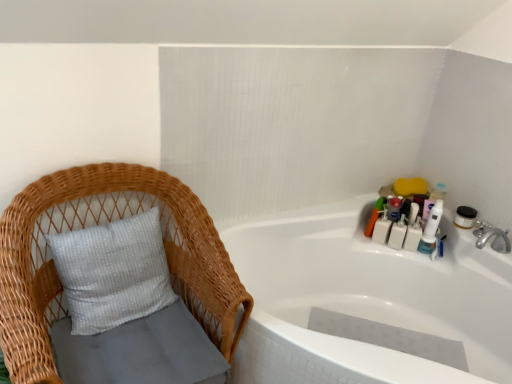
Question: From a real-world perspective, does white plastic bottles at upper right, the fourth toiletry in the right-to-left sequence, stand above white plastic toothbrush at upper right, which is counted as the first toiletry, starting from the right?

Choices:
 (A) yes
 (B) no

Answer: (B)

Question: Considering the relative sizes of white plastic bottles at upper right, the fourth toiletry in the right-to-left sequence, and white plastic toothbrush at upper right, which is counted as the first toiletry, starting from the right, in the image provided, is white plastic bottles at upper right, the fourth toiletry in the right-to-left sequence, taller than white plastic toothbrush at upper right, which is counted as the first toiletry, starting from the right,?

Choices:
 (A) yes
 (B) no

Answer: (B)

Question: Is the position of white plastic bottles at upper right, positioned as the 3th toiletry in left-to-right order, more distant than that of white plastic toothbrush at upper right, which is the 6th toiletry from left to right?

Choices:
 (A) no
 (B) yes

Answer: (B)

Question: Does white plastic bottles at upper right, positioned as the 3th toiletry in left-to-right order, appear on the right side of white plastic toothbrush at upper right, which is the 6th toiletry from left to right?

Choices:
 (A) yes
 (B) no

Answer: (B)

Question: From a real-world perspective, is white plastic bottles at upper right, the fourth toiletry in the right-to-left sequence, located beneath white plastic toothbrush at upper right, which is counted as the first toiletry, starting from the right?

Choices:
 (A) yes
 (B) no

Answer: (A)

Question: Does white plastic bottles at upper right, the fourth toiletry in the right-to-left sequence, appear on the left side of white plastic toothbrush at upper right, which is counted as the first toiletry, starting from the right?

Choices:
 (A) no
 (B) yes

Answer: (B)

Question: Is white plastic toothbrush at upper right, which is the 6th toiletry from left to right, looking in the opposite direction of white plastic bottles at upper right, the fifth toiletry when ordered from right to left?

Choices:
 (A) no
 (B) yes

Answer: (A)

Question: From a real-world perspective, does white plastic toothbrush at upper right, which is counted as the first toiletry, starting from the right, stand above white plastic bottles at upper right, the fifth toiletry when ordered from right to left?

Choices:
 (A) no
 (B) yes

Answer: (B)

Question: Is white plastic toothbrush at upper right, which is counted as the first toiletry, starting from the right, to the left of white plastic bottles at upper right, the fifth toiletry when ordered from right to left, from the viewer's perspective?

Choices:
 (A) yes
 (B) no

Answer: (B)

Question: Is white plastic toothbrush at upper right, which is the 6th toiletry from left to right, in contact with white plastic bottles at upper right, which is the second toiletry in left-to-right order?

Choices:
 (A) no
 (B) yes

Answer: (A)

Question: Considering the relative sizes of white plastic toothbrush at upper right, which is counted as the first toiletry, starting from the right, and white plastic bottles at upper right, which is the second toiletry in left-to-right order, in the image provided, is white plastic toothbrush at upper right, which is counted as the first toiletry, starting from the right, smaller than white plastic bottles at upper right, which is the second toiletry in left-to-right order,?

Choices:
 (A) yes
 (B) no

Answer: (B)

Question: Would you say white plastic toothbrush at upper right, which is the 6th toiletry from left to right, is a long distance from white plastic bottles at upper right, the fifth toiletry when ordered from right to left?

Choices:
 (A) yes
 (B) no

Answer: (B)

Question: Is white glossy bathtub at upper right positioned in front of matte plastic toothbrush at upper right, the sixth toiletry when ordered from right to left?

Choices:
 (A) no
 (B) yes

Answer: (B)